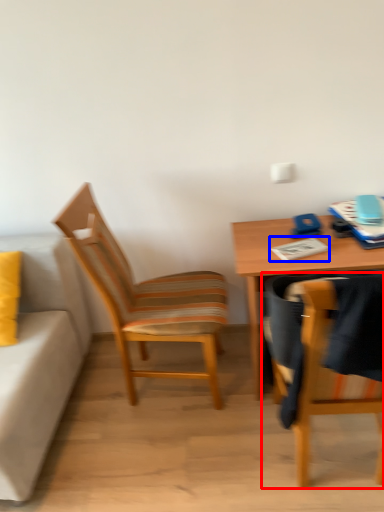
Question: Which object appears closest to the camera in this image, chair (highlighted by a red box) or notepad (highlighted by a blue box)?

Choices:
 (A) chair
 (B) notepad

Answer: (A)